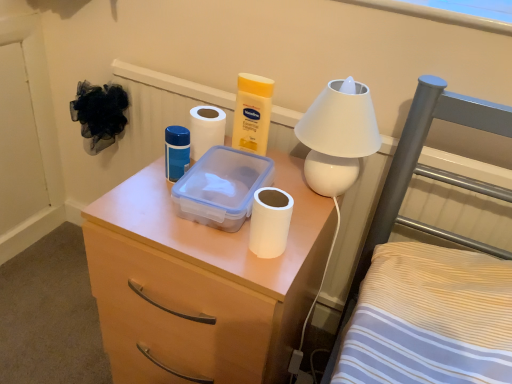
At what (x,y) coordinates should I click in order to perform the action: click on free space in front of blue matte container at center. Please return your answer as a coordinate pair (x, y). The height and width of the screenshot is (384, 512). Looking at the image, I should click on (168, 222).